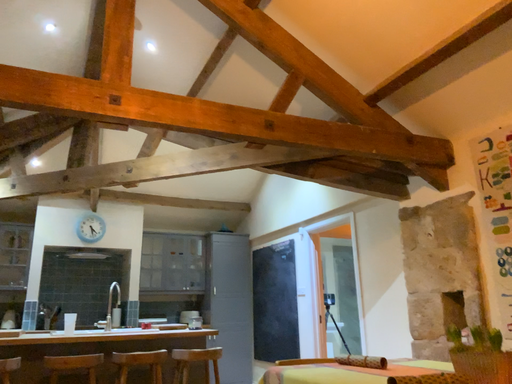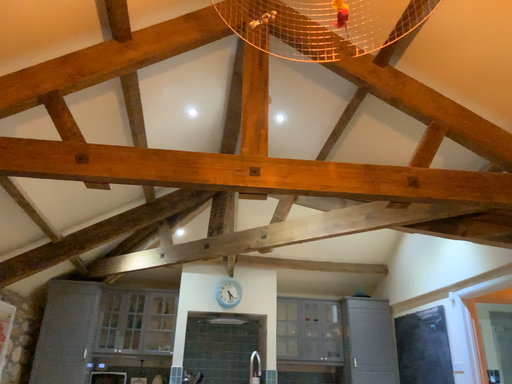
Question: How did the camera likely rotate when shooting the video?

Choices:
 (A) rotated left
 (B) rotated right

Answer: (A)